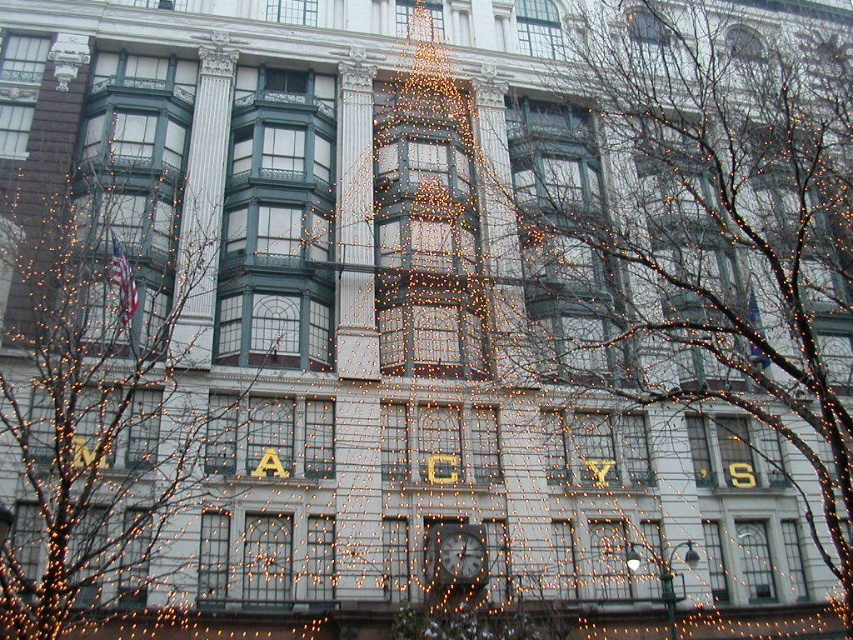
Question: Considering the relative positions of bare branches at center and illuminated wireframe tree at center in the image provided, where is bare branches at center located with respect to illuminated wireframe tree at center?

Choices:
 (A) above
 (B) below

Answer: (A)

Question: Among these objects, which one is farthest from the camera?

Choices:
 (A) illuminated wireframe tree at center
 (B) metallic clock at center

Answer: (B)

Question: Can you confirm if illuminated wireframe tree at center is positioned to the right of metallic clock at center?

Choices:
 (A) no
 (B) yes

Answer: (A)

Question: Which point is farther to the camera?

Choices:
 (A) illuminated wireframe tree at center
 (B) bare branches at center
 (C) metallic clock at center

Answer: (C)

Question: Which point is closer to the camera?

Choices:
 (A) (12, 536)
 (B) (430, 536)
 (C) (682, 188)

Answer: (A)

Question: Where is bare branches at center located in relation to metallic clock at center in the image?

Choices:
 (A) below
 (B) above

Answer: (B)